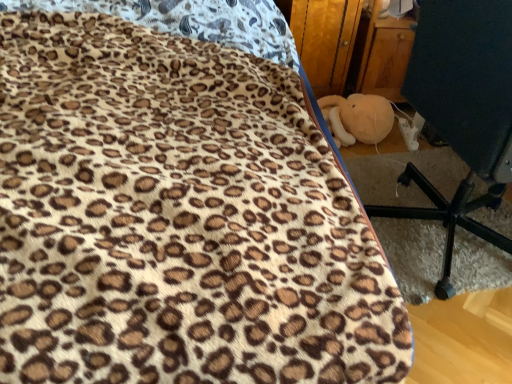
Question: Does soft plush toy at lower right appear on the left side of wooden at right?

Choices:
 (A) yes
 (B) no

Answer: (B)

Question: From the image's perspective, would you say soft plush toy at lower right is shown under wooden at right?

Choices:
 (A) no
 (B) yes

Answer: (B)

Question: From a real-world perspective, is soft plush toy at lower right under wooden at right?

Choices:
 (A) no
 (B) yes

Answer: (B)

Question: Can you confirm if soft plush toy at lower right is bigger than wooden at right?

Choices:
 (A) no
 (B) yes

Answer: (A)

Question: Considering the relative sizes of soft plush toy at lower right and wooden at right in the image provided, is soft plush toy at lower right wider than wooden at right?

Choices:
 (A) no
 (B) yes

Answer: (A)

Question: Is soft plush toy at lower right outside of wooden at right?

Choices:
 (A) yes
 (B) no

Answer: (A)

Question: Is black plastic chair at lower right looking in the opposite direction of wooden at right?

Choices:
 (A) yes
 (B) no

Answer: (B)

Question: Is black plastic chair at lower right at the left side of wooden at right?

Choices:
 (A) no
 (B) yes

Answer: (A)

Question: Can you confirm if black plastic chair at lower right is shorter than wooden at right?

Choices:
 (A) yes
 (B) no

Answer: (B)

Question: Can you confirm if black plastic chair at lower right is thinner than wooden at right?

Choices:
 (A) no
 (B) yes

Answer: (A)

Question: From the image's perspective, does black plastic chair at lower right appear lower than wooden at right?

Choices:
 (A) yes
 (B) no

Answer: (A)

Question: Does black plastic chair at lower right have a greater height compared to wooden at right?

Choices:
 (A) no
 (B) yes

Answer: (B)

Question: Considering the relative sizes of black plastic chair at lower right and soft plush toy at lower right in the image provided, is black plastic chair at lower right bigger than soft plush toy at lower right?

Choices:
 (A) no
 (B) yes

Answer: (B)